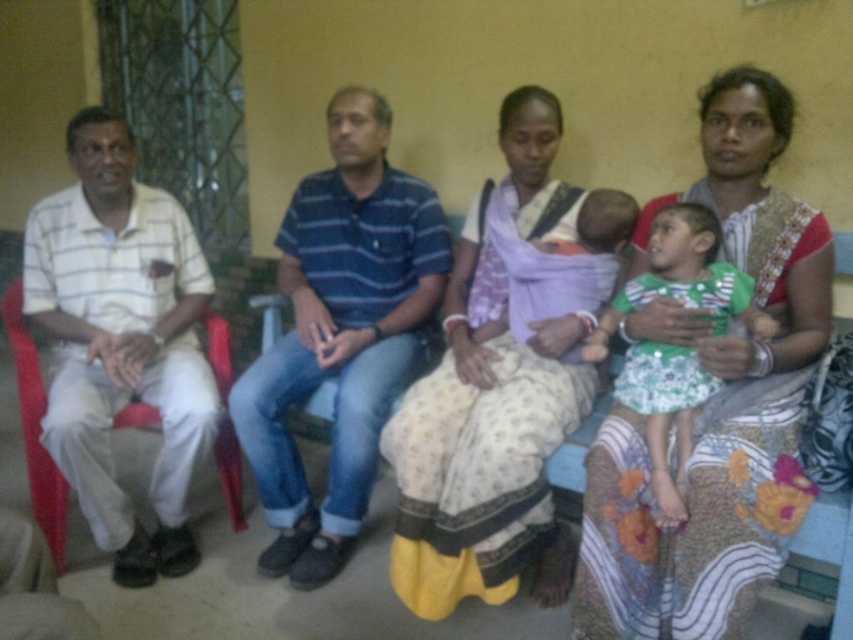
You are organizing a clothing donation drive and need to determine if the printed cotton saree at right can be folded and placed in a box designed for the blue striped shirt at center. Based on their widths, will the saree fit into the box?

The printed cotton saree at right might be wider than the blue striped shirt at center, so there is a possibility that the saree may not fit into the box designed for the shirt due to its potentially greater width.

In the scene described, you are standing in front of the group of people. Which object is positioned more to the right between the printed cotton saree at right and the blue striped shirt at center?

The printed cotton saree at right is positioned more to the right than the blue striped shirt at center according to the description.